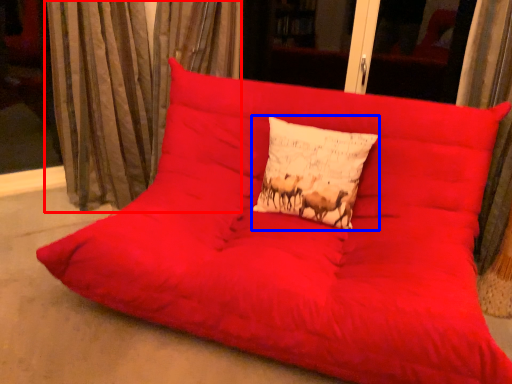
Question: Which object appears farthest to the camera in this image, curtain (highlighted by a red box) or pillow (highlighted by a blue box)?

Choices:
 (A) curtain
 (B) pillow

Answer: (A)